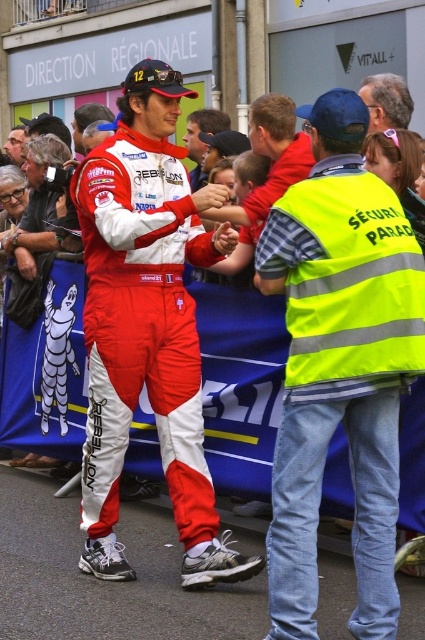
Question: Which of these objects is positioned closest to the neon yellow reflective vest at center?

Choices:
 (A) matte red racing suit at center
 (B) gray hair at upper center
 (C) white synthetic sneakers at lower center

Answer: (A)

Question: Which of the following is the farthest from the observer?

Choices:
 (A) matte red racing suit at center
 (B) white synthetic sneakers at lower center

Answer: (A)

Question: Does neon yellow reflective vest at center have a lesser width compared to gray hair at upper center?

Choices:
 (A) yes
 (B) no

Answer: (B)

Question: Does white synthetic sneakers at lower center appear under gray hair at upper center?

Choices:
 (A) yes
 (B) no

Answer: (A)

Question: Is white synthetic sneakers at lower center positioned before gray hair at upper center?

Choices:
 (A) yes
 (B) no

Answer: (A)

Question: Which of the following is the farthest from the observer?

Choices:
 (A) gray hair at upper center
 (B) matte red racing suit at center
 (C) neon yellow reflective vest at center

Answer: (A)